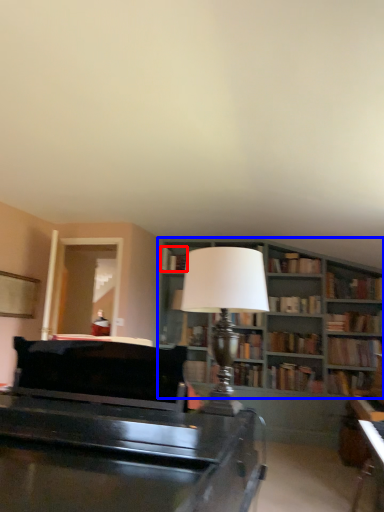
Question: Which of the following is the closest to the observer, book (highlighted by a red box) or bookcase (highlighted by a blue box)?

Choices:
 (A) book
 (B) bookcase

Answer: (B)